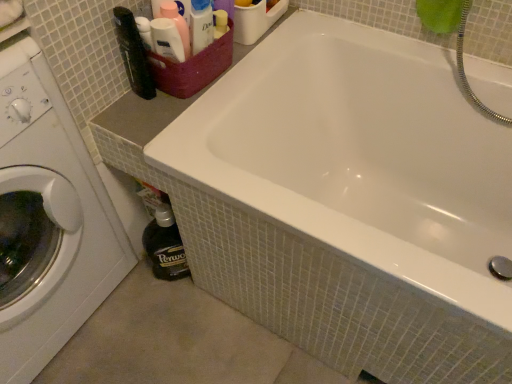
Question: From the image's perspective, would you say white glossy bathtub at upper center is shown under white glossy washing machine at left?

Choices:
 (A) yes
 (B) no

Answer: (B)

Question: Considering the relative positions of white glossy bathtub at upper center and white glossy washing machine at left in the image provided, is white glossy bathtub at upper center to the left of white glossy washing machine at left from the viewer's perspective?

Choices:
 (A) yes
 (B) no

Answer: (B)

Question: Would you say white glossy washing machine at left is part of white glossy bathtub at upper center's contents?

Choices:
 (A) no
 (B) yes

Answer: (A)

Question: From the image's perspective, is white glossy bathtub at upper center above white glossy washing machine at left?

Choices:
 (A) yes
 (B) no

Answer: (A)

Question: Is white glossy bathtub at upper center at the right side of white glossy washing machine at left?

Choices:
 (A) yes
 (B) no

Answer: (A)

Question: Can you confirm if white glossy bathtub at upper center is taller than white glossy washing machine at left?

Choices:
 (A) yes
 (B) no

Answer: (B)

Question: From the image's perspective, is maroon woven basket at upper left over white glossy bathtub at upper center?

Choices:
 (A) no
 (B) yes

Answer: (B)

Question: Can you confirm if maroon woven basket at upper left is taller than white glossy bathtub at upper center?

Choices:
 (A) no
 (B) yes

Answer: (A)

Question: From a real-world perspective, is maroon woven basket at upper left located beneath white glossy bathtub at upper center?

Choices:
 (A) yes
 (B) no

Answer: (B)

Question: From the image's perspective, is maroon woven basket at upper left located beneath white glossy bathtub at upper center?

Choices:
 (A) no
 (B) yes

Answer: (A)

Question: Can you confirm if maroon woven basket at upper left is thinner than white glossy bathtub at upper center?

Choices:
 (A) no
 (B) yes

Answer: (B)

Question: Is white glossy bathtub at upper center completely or partially inside maroon woven basket at upper left?

Choices:
 (A) no
 (B) yes

Answer: (A)

Question: Can you confirm if white glossy washing machine at left is positioned to the left of maroon woven basket at upper left?

Choices:
 (A) no
 (B) yes

Answer: (B)